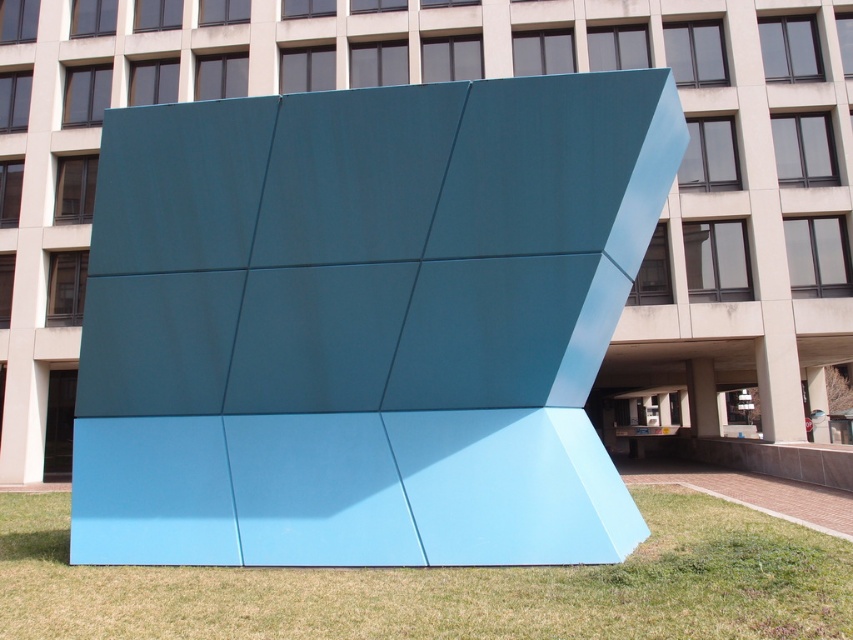
You are standing at the edge of the paved walkway and want to place a 5.5 feet long ladder between the teal matte sculpture at center and the green grass at lower center. Can the ladder fit in the space between them without overlapping either?

The distance between the teal matte sculpture at center and the green grass at lower center is 5.05 feet. Since the ladder is 5.5 feet long, which is longer than the available space, it cannot fit without overlapping one of them.

You are a landscape architect designing a new garden. You want to place a new decorative fountain that requires a space larger than the teal matte sculpture at center. Can the green grass at lower center accommodate the fountain?

The teal matte sculpture at center is bigger than green grass at lower center. Since the fountain requires a space larger than the sculpture, the green grass at lower center is not large enough to accommodate it.

You are standing at the entrance of the building and want to find the teal matte sculpture at center. Based on the coordinates provided, in which direction should you walk from your current position to reach it?

The teal matte sculpture at center is located at coordinates point (364,323), so you should walk straight ahead from the entrance towards the center of the image to reach it.